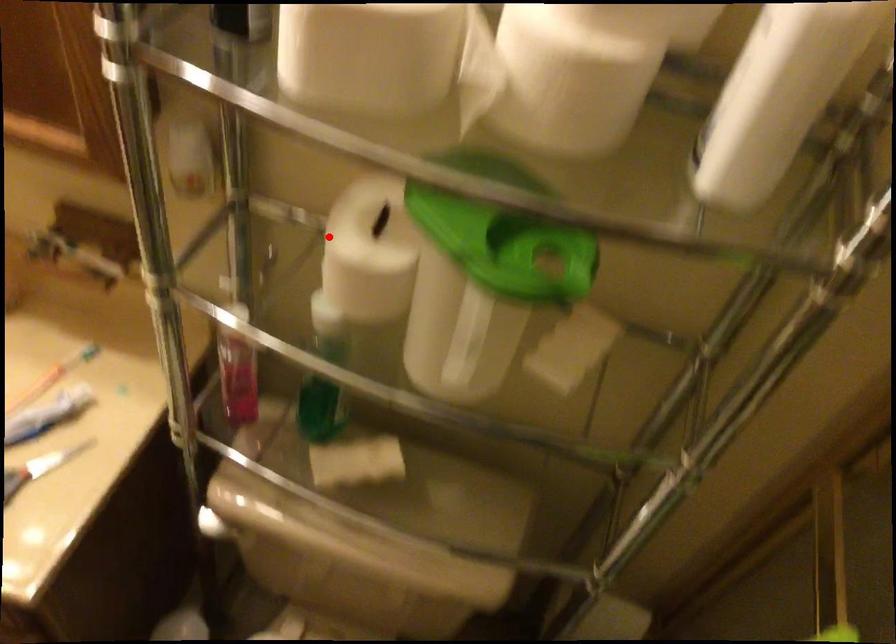
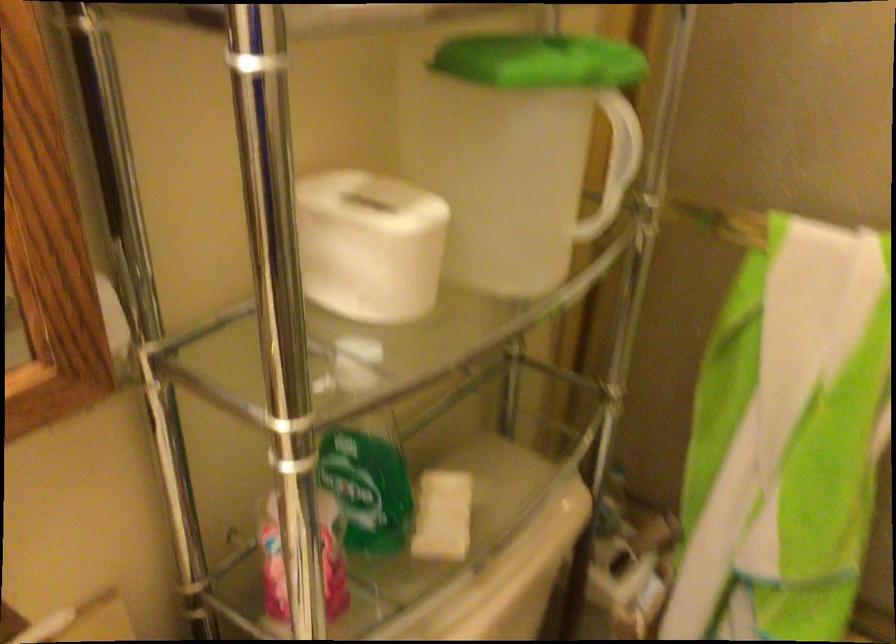
The point at the highlighted location is marked in the first image. Where is the corresponding point in the second image?

(369, 245)